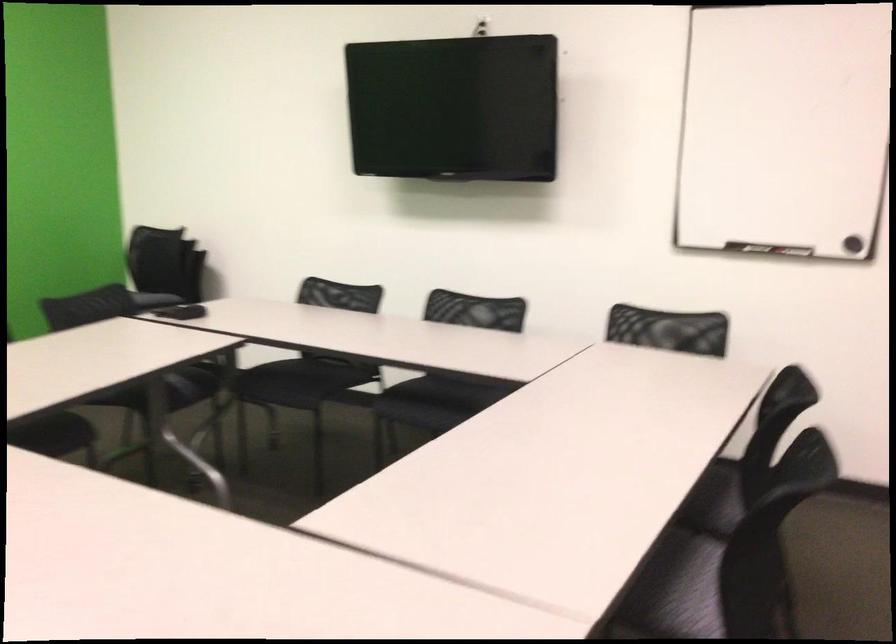
The location [181,310] corresponds to which object?

It corresponds to the small black object in the image.